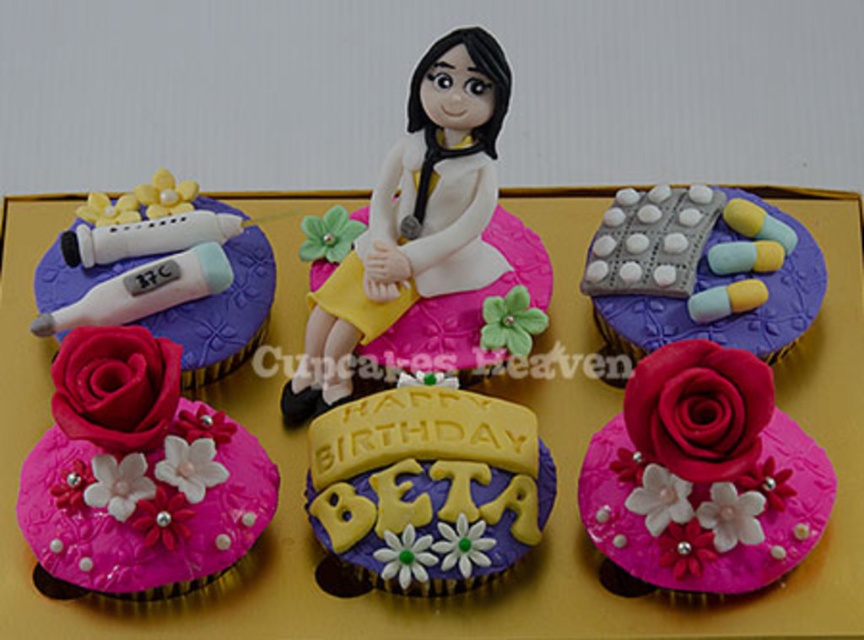
Which object is located at the coordinates point (137, 476)?

The matte pink fondant rose at lower left is located at point (137, 476).

You are at a birthday party and see the matte pink rose at lower left and the gray pill blister pack at upper right on the cupcake tray. Which object is taller?

The matte pink rose at lower left is much taller than the gray pill blister pack at upper right.